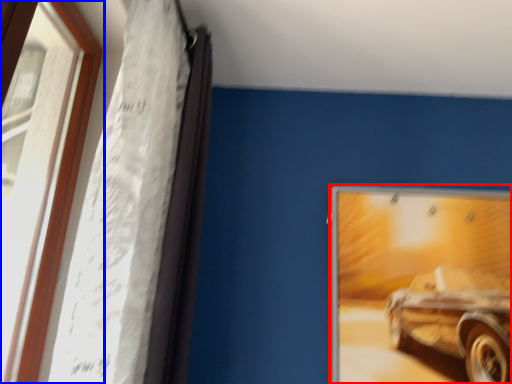
Question: Which point is closer to the camera, picture frame (highlighted by a red box) or window (highlighted by a blue box)?

Choices:
 (A) picture frame
 (B) window

Answer: (B)